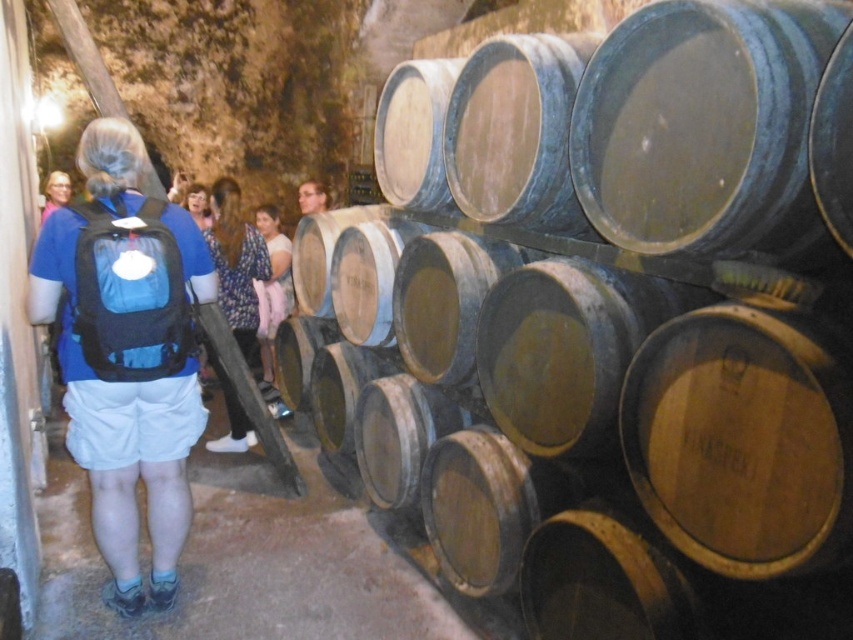
Consider the image. Is floral dress at center below matte blue backpack at center?

Yes.

Identify the location of floral dress at center. The width and height of the screenshot is (853, 640). (236, 262).

Is wooden barrel at center behind blue backpack at center?

No, wooden barrel at center is in front of blue backpack at center.

Who is taller, wooden barrel at center or blue backpack at center?

With more height is wooden barrel at center.

Does point (582, 45) come behind point (49, 209)?

No, (582, 45) is in front of (49, 209).

Locate an element on the screen. The width and height of the screenshot is (853, 640). wooden barrel at center is located at coordinates (610, 323).

Can you confirm if blue fabric backpack at left is positioned to the right of matte blue backpack at center?

Yes, blue fabric backpack at left is to the right of matte blue backpack at center.

Between blue fabric backpack at left and matte blue backpack at center, which one has less height?

With less height is matte blue backpack at center.

What do you see at coordinates (126, 358) in the screenshot?
I see `blue fabric backpack at left` at bounding box center [126, 358].

This screenshot has width=853, height=640. I want to click on blue fabric backpack at left, so click(x=126, y=358).